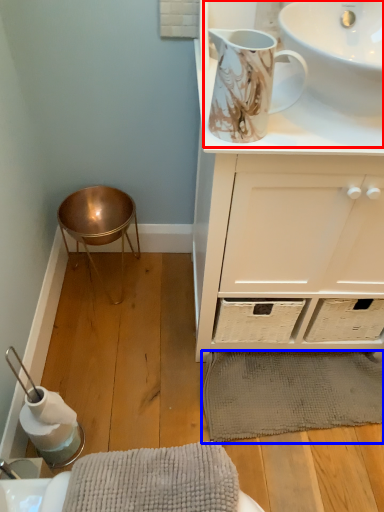
Question: Which of the following is the farthest to the observer, sink (highlighted by a red box) or bath mat (highlighted by a blue box)?

Choices:
 (A) sink
 (B) bath mat

Answer: (B)